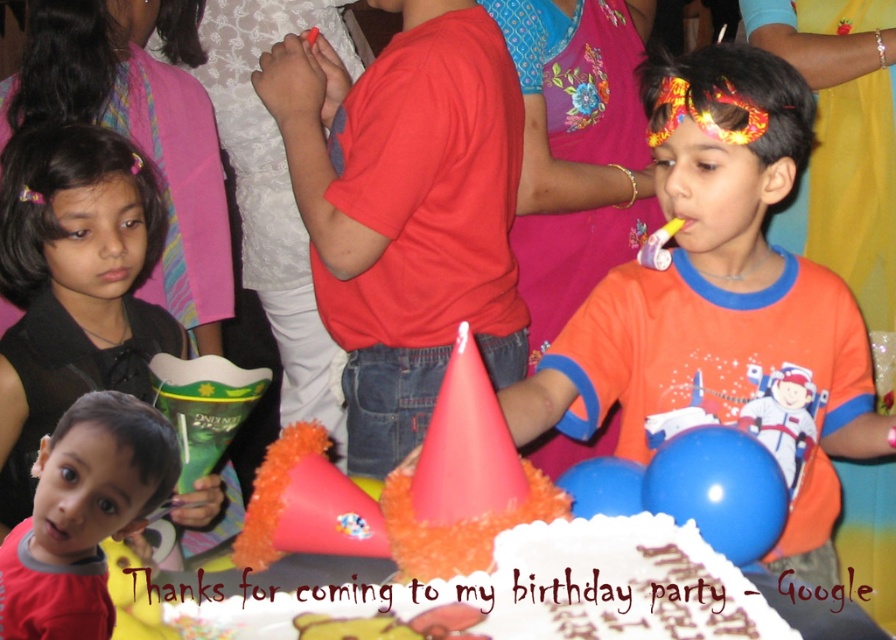
You are a photographer at the birthday party and want to take a photo of the white frosted cake at center and the matte red shirt at lower left. Based on their positions, which object is located to the right of the other?

The white frosted cake at center is positioned on the right side of matte red shirt at lower left, so the cake is to the right of the red shirt.

You are a photographer at the birthday party. You need to capture a photo where the orange cotton shirt at center is clearly visible without being blocked by the white frosted cake at center. Based on their positions, is this possible?

The orange cotton shirt at center is above the white frosted cake at center, so it is possible to capture a clear photo of the orange cotton shirt at center without obstruction from the cake.